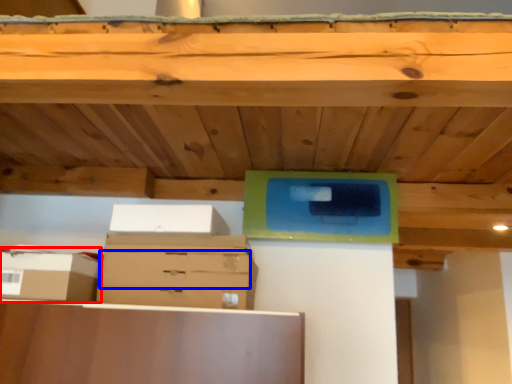
Question: Among these objects, which one is nearest to the camera, storage box (highlighted by a red box) or drawer (highlighted by a blue box)?

Choices:
 (A) storage box
 (B) drawer

Answer: (A)